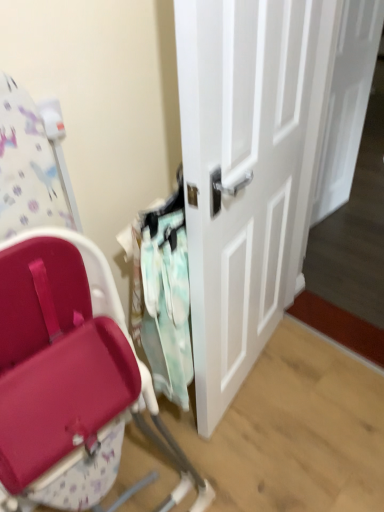
At what (x,y) coordinates should I click in order to perform the action: click on free spot in front of white glossy door at center, which is the first door from left to right. Please return your answer as a coordinate pair (x, y). Looking at the image, I should click on (278, 443).